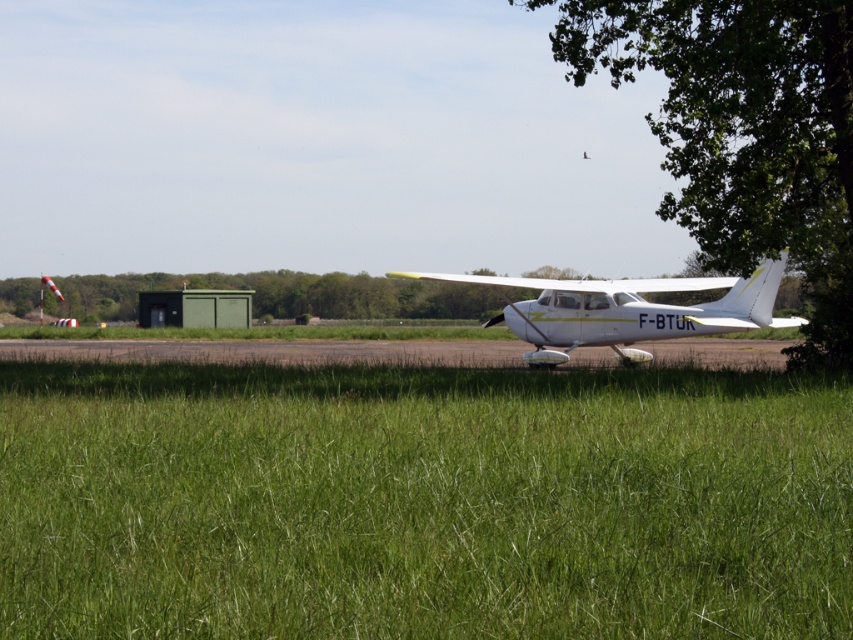
Question: Observing the image, what is the correct spatial positioning of green grass at center in reference to white matte airplane at center?

Choices:
 (A) right
 (B) left

Answer: (B)

Question: Which of the following is the closest to the observer?

Choices:
 (A) green grass at center
 (B) green leafy tree at right

Answer: (A)

Question: Does green leafy tree at right have a greater width compared to white matte airplane at center?

Choices:
 (A) no
 (B) yes

Answer: (B)

Question: Does green grass at center have a larger size compared to green leafy tree at right?

Choices:
 (A) yes
 (B) no

Answer: (B)

Question: Based on their relative distances, which object is nearer to the green grass at center?

Choices:
 (A) white matte airplane at center
 (B) green leafy tree at right

Answer: (A)

Question: Which point is closer to the camera?

Choices:
 (A) white matte airplane at center
 (B) green leafy tree at right
 (C) green grass at center

Answer: (C)